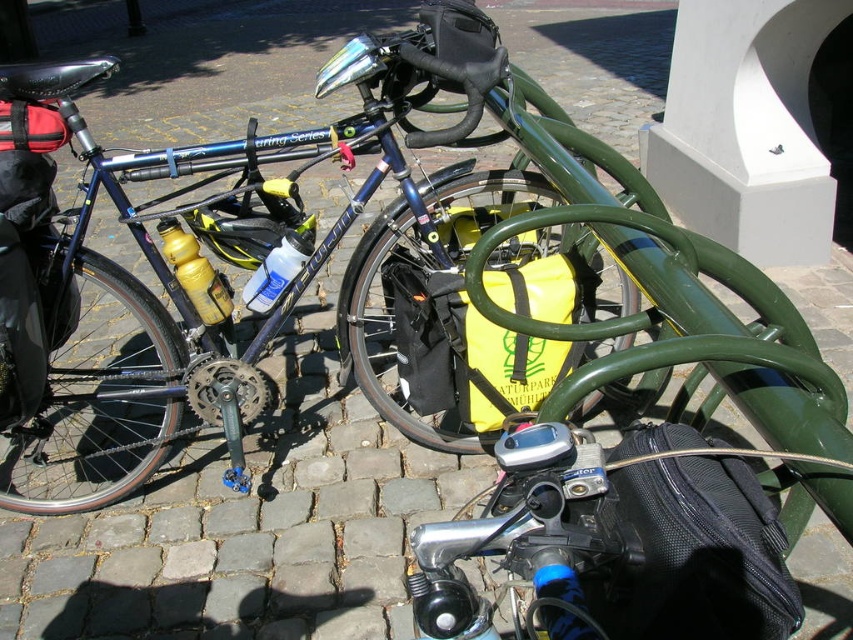
Looking at this image, you are a cyclist who just arrived at a rest stop and need to access your gear. You see a black mesh bag at lower right. Based on its position, which part of the bicycle is it most likely attached to?

The black mesh bag at lower right is located at point 0.824 on the y axis, which is lower than the handlebars and closer to the rear of the bicycle. It is most likely attached to the rear rack with a red bag.

You are a cyclist preparing for a trip and need to know which bag has more space. Based on the image, which bag between the black mesh bag at lower right and the yellow matte bag at center is wider?

The yellow matte bag at center is wider than the black mesh bag at lower right.